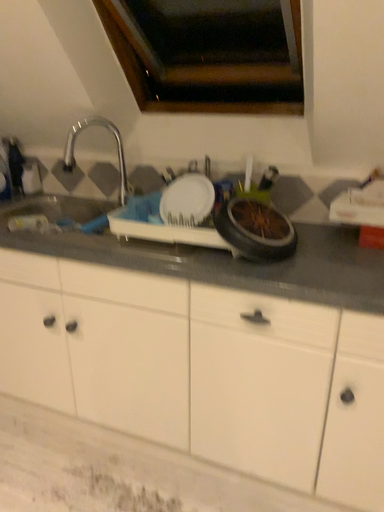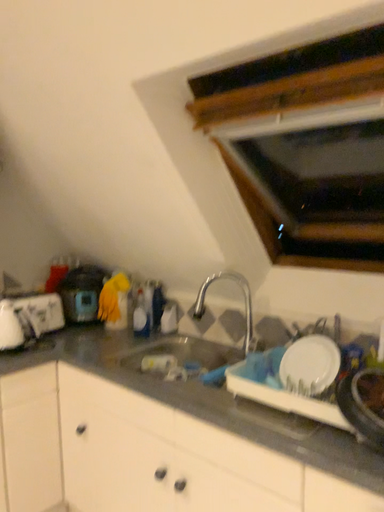
Question: How did the camera likely rotate when shooting the video?

Choices:
 (A) rotated upward
 (B) rotated downward

Answer: (A)